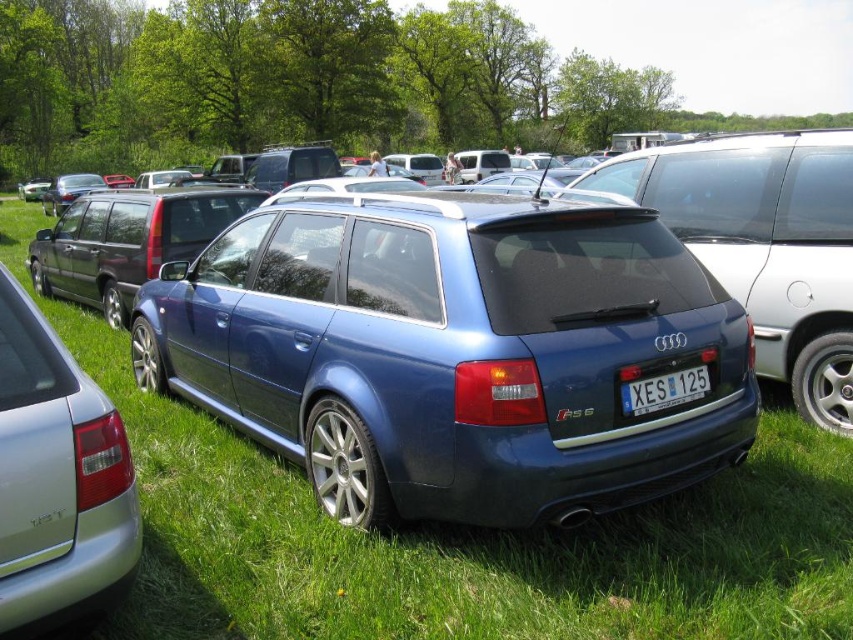
Is satin silver sedan at lower left in front of matte black minivan at center?

Yes, it is.

Is point (61, 593) closer to camera compared to point (51, 285)?

Yes, it is.

The image size is (853, 640). Describe the element at coordinates (57, 476) in the screenshot. I see `satin silver sedan at lower left` at that location.

You are a GUI agent. You are given a task and a screenshot of the screen. Output one action in this format:
    pyautogui.click(x=<x>, y=<y>)
    Task: Click on the satin silver sedan at lower left
    This screenshot has width=853, height=640.
    Given the screenshot: What is the action you would take?
    pyautogui.click(x=57, y=476)

Does metallic blue station wagon at center have a lesser width compared to satin silver sedan at lower left?

Incorrect, metallic blue station wagon at center's width is not less than satin silver sedan at lower left's.

Is point (683, 212) more distant than point (70, 598)?

Yes, point (683, 212) is behind point (70, 598).

In order to click on metallic blue station wagon at center in this screenshot , I will do `click(521, 326)`.

Can you confirm if matte black minivan at center is smaller than white plastic license plate at center?

No, matte black minivan at center is not smaller than white plastic license plate at center.

Who is more forward, [108,291] or [697,394]?

Point [697,394] is more forward.

I want to click on matte black minivan at center, so click(128, 241).